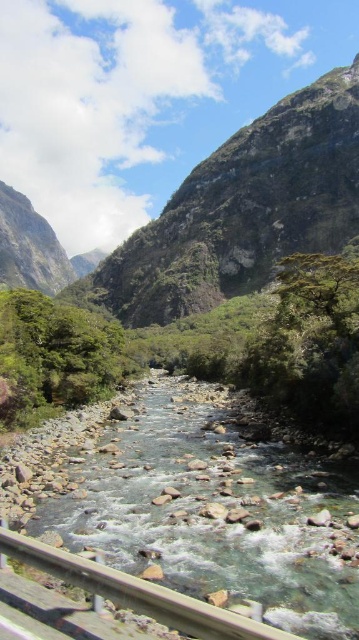
Question: Which object is positioned farthest from the green rocky mountain at upper center?

Choices:
 (A) smooth rock stream at center
 (B) wooden rail at lower left

Answer: (B)

Question: Which point is closer to the camera taking this photo?

Choices:
 (A) (129, 552)
 (B) (353, 131)
 (C) (67, 570)

Answer: (C)

Question: Does smooth rock stream at center appear on the right side of green rocky mountain at upper center?

Choices:
 (A) yes
 (B) no

Answer: (B)

Question: Does smooth rock stream at center appear under green rocky mountain at upper center?

Choices:
 (A) no
 (B) yes

Answer: (B)

Question: Which is farther from the wooden rail at lower left?

Choices:
 (A) green rocky mountain at upper center
 (B) smooth rock stream at center

Answer: (A)

Question: Does smooth rock stream at center come behind green rocky mountain at upper center?

Choices:
 (A) no
 (B) yes

Answer: (A)